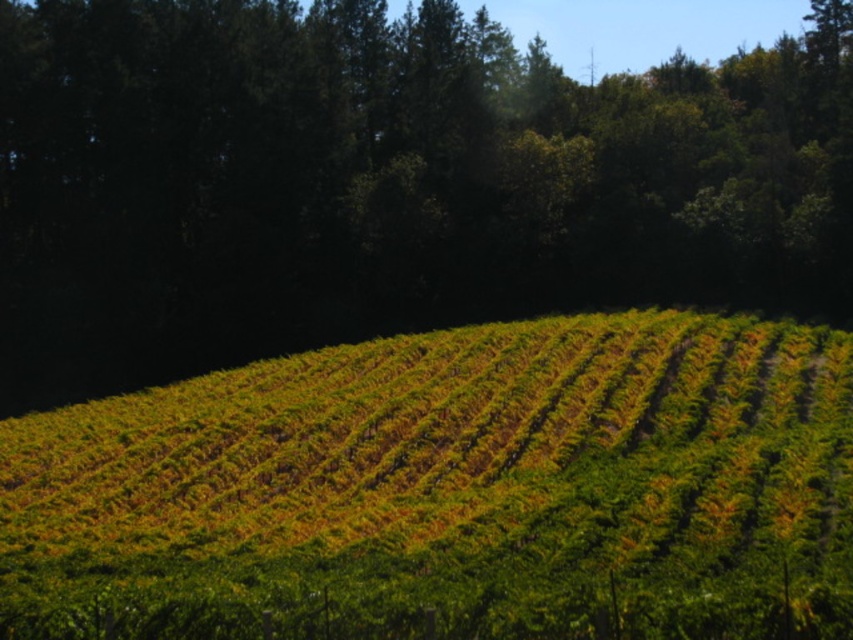
Does green leafy tree at center lie in front of green leafy hillside at center?

That is False.

Who is lower down, green leafy tree at center or green leafy hillside at center?

green leafy hillside at center is lower down.

This screenshot has width=853, height=640. Describe the element at coordinates (384, 180) in the screenshot. I see `green leafy tree at center` at that location.

Identify the location of green leafy tree at center. (384, 180).